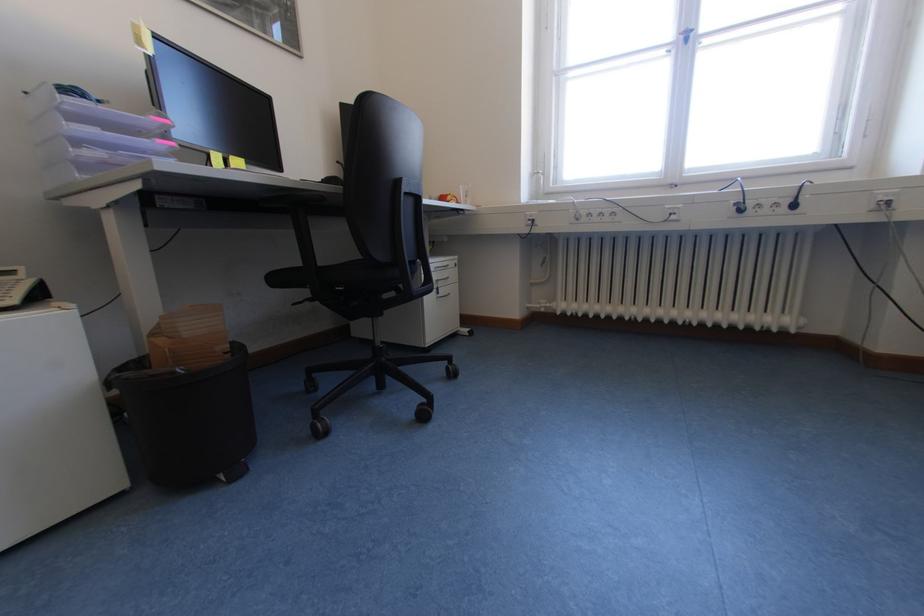
Identify the location of white window handle. (537, 183).